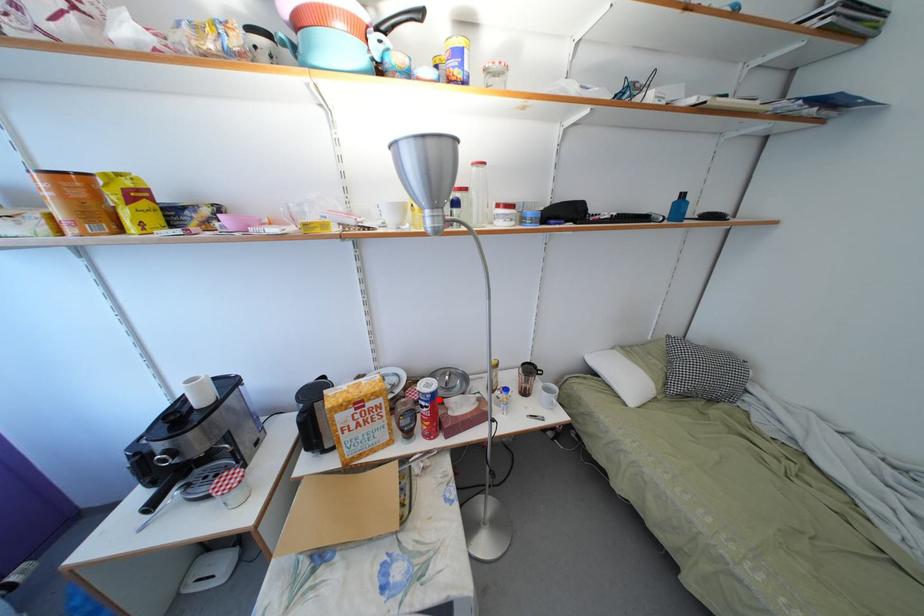
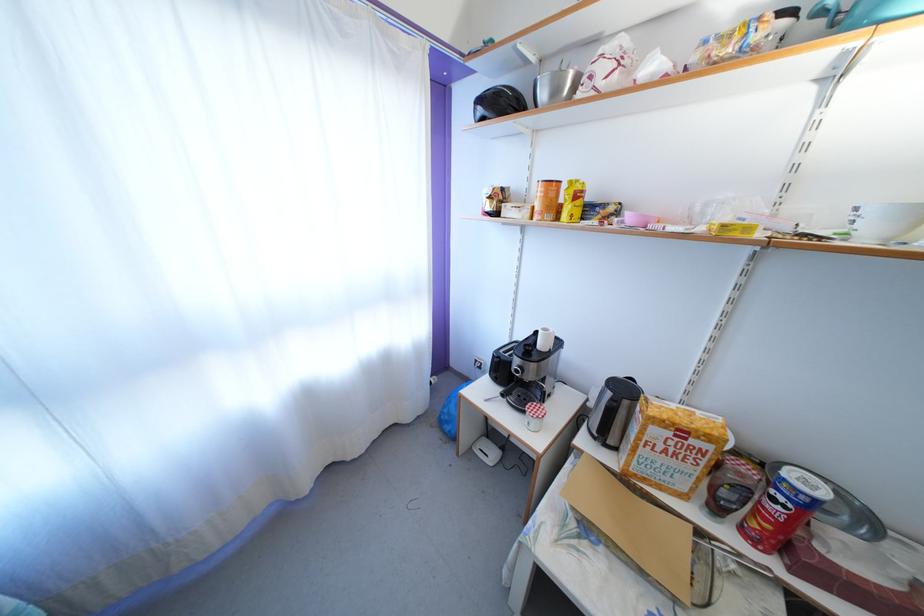
Question: I am providing you with two images of the same scene from different viewpoints. Image1 has a red point marked. In image2, the corresponding 3D location appears at what relative position? Reply with the corresponding letter.

Choices:
 (A) Closer
 (B) Farther

Answer: (A)